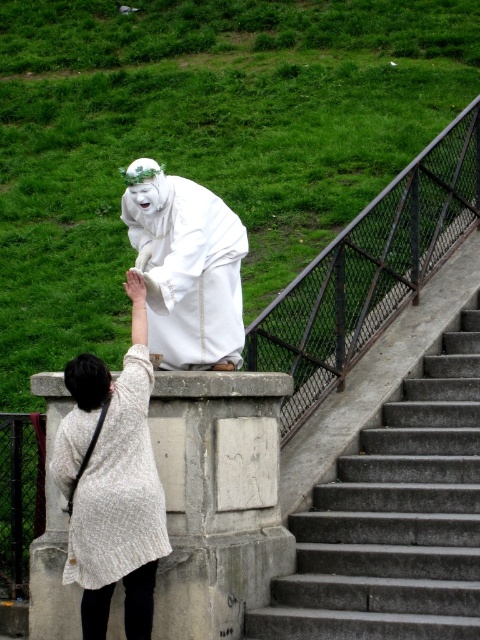
In the scene shown: You are a painter setting up an easel to capture the scene. You notice the rusty metal rail at upper center and the white textured coat at center. Which object should you focus on first if you want to paint the larger one?

The white textured coat at center is larger than the rusty metal rail at upper center, so you should focus on painting the white textured coat at center first.

You are a delivery person needing to place a package between the concrete stairs at center and the white textured coat at center. The package requires a minimum of 2 meters of space. Can you fit it there?

The concrete stairs at center and white textured coat at center are 2.16 meters apart, which is sufficient to accommodate the package requiring a minimum of 2 meters of space.

You are a painter setting up an easel to capture the scene. You need to decide which object, the rusty metal rail at upper center or the white textured coat at center, will appear thinner in your painting. Which one should you expect to paint as thinner?

The rusty metal rail at upper center has a lesser width compared to the white textured coat at center, so you should paint the rusty metal rail at upper center as thinner.